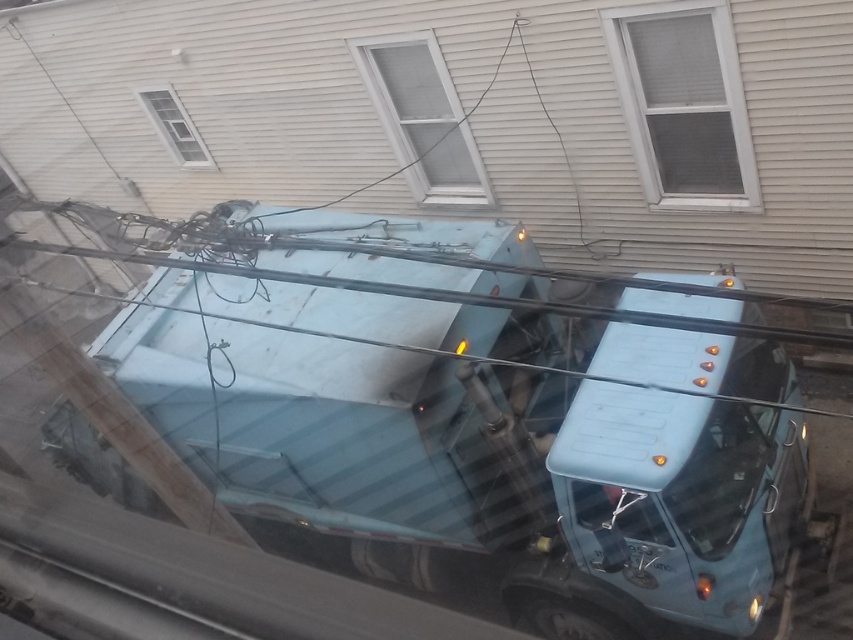
Can you confirm if white mesh screen at upper center is smaller than white textured window at center?

No.

Which is behind, point (723, 108) or point (454, 113)?

Point (454, 113)

Locate an element on the screen. white mesh screen at upper center is located at coordinates (683, 104).

The width and height of the screenshot is (853, 640). Find the location of `white mesh screen at upper center`. white mesh screen at upper center is located at coordinates (683, 104).

Is light blue metallic garbage truck at center bigger than white mesh screen at upper center?

Indeed, light blue metallic garbage truck at center has a larger size compared to white mesh screen at upper center.

Does light blue metallic garbage truck at center have a smaller size compared to white mesh screen at upper center?

No, light blue metallic garbage truck at center is not smaller than white mesh screen at upper center.

The image size is (853, 640). In order to click on light blue metallic garbage truck at center in this screenshot , I will do `click(474, 422)`.

Does white mesh screen at upper center have a smaller size compared to white textured window at upper left?

No.

In the scene shown: Does white mesh screen at upper center have a lesser height compared to white textured window at upper left?

No, white mesh screen at upper center is not shorter than white textured window at upper left.

Who is more distant from viewer, (724, 177) or (165, 128)?

Point (165, 128)

What are the coordinates of `white mesh screen at upper center` in the screenshot? It's located at (683, 104).